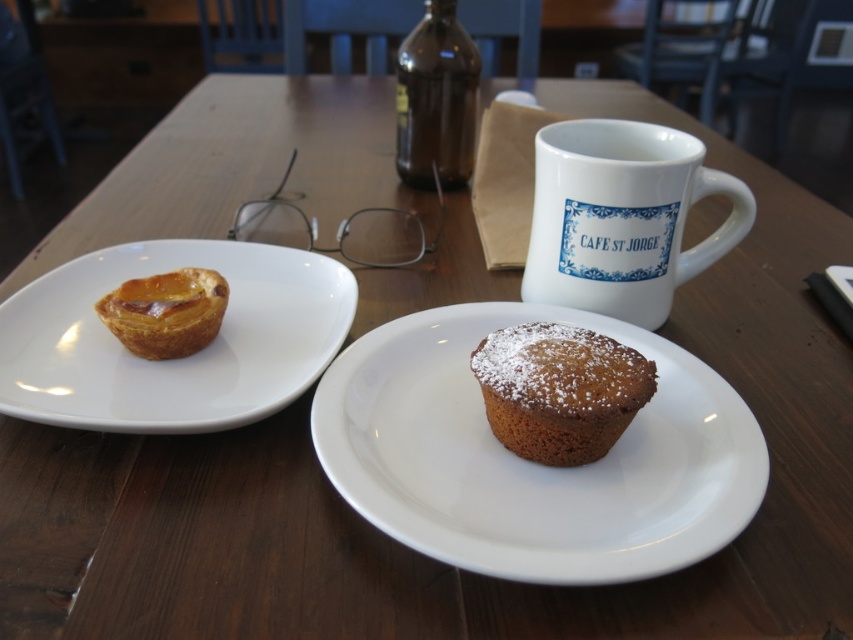
You are a baker who wants to place both the powdered brown cupcake at center and the brown glass bottle at upper center into a rectangular box. The box can only fit items that are narrower than 10 cm. Based on their widths, can both items fit inside the box?

The powdered brown cupcake at center is wider than the brown glass bottle at upper center. Since the cupcake is wider and the box requires items narrower than 10 cm, we need to know the exact width of the cupcake. However, the description only states that the cupcake is wider than the bottle but doesn

You are a customer at the cafe and want to grab both the white glossy plate at left and the white ceramic mug at upper right. Which one should you reach for first if you want to pick up the closer item first?

The white glossy plate at left is closer to the viewer than the white ceramic mug at upper right, so you should reach for the white glossy plate at left first.

You are at a cozy cafe and want to place a napkin between the white glossy plate at left and the white ceramic mug at upper right. Based on their positions, which side of the plate should you place it on?

The white glossy plate at left is to the left of the white ceramic mug at upper right, so you should place the napkin to the right side of the white glossy plate at left to position it between them.